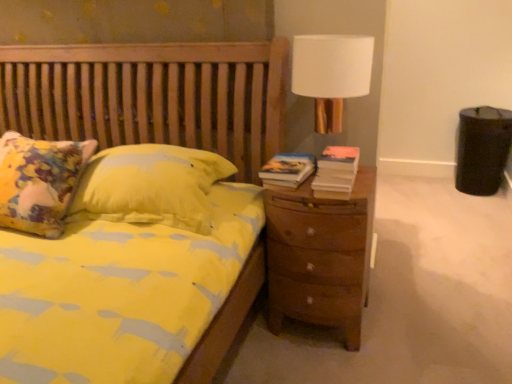
What do you see at coordinates (287, 169) in the screenshot?
I see `hardcover book at right, the 1th book positioned from the left` at bounding box center [287, 169].

Measure the distance between white fabric lampshade at upper right and camera.

white fabric lampshade at upper right and camera are 1.49 meters apart from each other.

What are the coordinates of `white fabric lampshade at upper right` in the screenshot? It's located at (331, 74).

Identify the location of hardcover book at right, the first book positioned from the right. (336, 169).

From a real-world perspective, is hardcover book at right, which is the 2th book in right-to-left order, physically located above or below brown wooden nightstand at right?

From a real-world perspective, hardcover book at right, which is the 2th book in right-to-left order, is physically above brown wooden nightstand at right.

Is the position of hardcover book at right, the 1th book positioned from the left, more distant than that of brown wooden nightstand at right?

Yes.

Is hardcover book at right, which is the 2th book in right-to-left order, at the left side of brown wooden nightstand at right?

Correct, you'll find hardcover book at right, which is the 2th book in right-to-left order, to the left of brown wooden nightstand at right.

Is brown wooden nightstand at right located within hardcover book at right, which is the 2th book in right-to-left order?

No.

Does hardcover book at right, the 1th book positioned from the left, have a greater height compared to hardcover book at right, the first book positioned from the right?

No.

Is hardcover book at right, which is the 2th book in right-to-left order, outside of hardcover book at right, the first book positioned from the right?

Yes.

Would you consider hardcover book at right, the 1th book positioned from the left, to be distant from hardcover book at right, the first book positioned from the right?

No.

At what (x,y) coordinates should I click in order to perform the action: click on book that is above the hardcover book at right, which is the 2th book in right-to-left order (from a real-world perspective). Please return your answer as a coordinate pair (x, y). This screenshot has height=384, width=512. Looking at the image, I should click on (336, 169).

Is brown wooden nightstand at right wider or thinner than hardcover book at right, which appears as the second book when viewed from the left?

brown wooden nightstand at right is wider than hardcover book at right, which appears as the second book when viewed from the left.

Based on the photo, considering the sizes of brown wooden nightstand at right and hardcover book at right, the first book positioned from the right, in the image, is brown wooden nightstand at right bigger or smaller than hardcover book at right, the first book positioned from the right,?

Considering their sizes, brown wooden nightstand at right takes up more space than hardcover book at right, the first book positioned from the right.

From the image's perspective, who appears lower, brown wooden nightstand at right or hardcover book at right, the first book positioned from the right?

brown wooden nightstand at right.

From a real-world perspective, is brown wooden nightstand at right physically below hardcover book at right, the first book positioned from the right?

Indeed, from a real-world perspective, brown wooden nightstand at right is positioned beneath hardcover book at right, the first book positioned from the right.

From the image's perspective, is brown wooden nightstand at right located above or below hardcover book at right, which is the 2th book in right-to-left order?

brown wooden nightstand at right is situated lower than hardcover book at right, which is the 2th book in right-to-left order, in the image.

Looking at this image, choose the correct answer: Is brown wooden nightstand at right inside hardcover book at right, which is the 2th book in right-to-left order, or outside it?

brown wooden nightstand at right is not enclosed by hardcover book at right, which is the 2th book in right-to-left order.

Which object is thinner, brown wooden nightstand at right or hardcover book at right, the 1th book positioned from the left?

hardcover book at right, the 1th book positioned from the left.

From a real-world perspective, between brown wooden nightstand at right and hardcover book at right, which is the 2th book in right-to-left order, who is vertically lower?

From a 3D spatial view, brown wooden nightstand at right is below.

Between point (348, 168) and point (308, 162), which one is positioned behind?

The point (308, 162) is farther from the camera.

I want to click on book on the right of hardcover book at right, which is the 2th book in right-to-left order, so 336,169.

Is hardcover book at right, the first book positioned from the right, looking in the opposite direction of hardcover book at right, which is the 2th book in right-to-left order?

hardcover book at right, the first book positioned from the right, does not have its back to hardcover book at right, which is the 2th book in right-to-left order.

From a real-world perspective, which object stands above the other?

hardcover book at right, which appears as the second book when viewed from the left.

Can you confirm if hardcover book at right, the 1th book positioned from the left, is bigger than white fabric lampshade at upper right?

Incorrect, hardcover book at right, the 1th book positioned from the left, is not larger than white fabric lampshade at upper right.

Is hardcover book at right, the 1th book positioned from the left, not within white fabric lampshade at upper right?

That's incorrect, hardcover book at right, the 1th book positioned from the left, is not completely outside white fabric lampshade at upper right.

Is hardcover book at right, which is the 2th book in right-to-left order, with white fabric lampshade at upper right?

Result: No, hardcover book at right, which is the 2th book in right-to-left order, is not making contact with white fabric lampshade at upper right.

Is the position of hardcover book at right, the first book positioned from the right, more distant than that of white fabric lampshade at upper right?

Yes, hardcover book at right, the first book positioned from the right, is behind white fabric lampshade at upper right.

Find the location of `lamp in front of the hardcover book at right, the first book positioned from the right`. lamp in front of the hardcover book at right, the first book positioned from the right is located at coordinates (331, 74).

Measure the distance from hardcover book at right, the first book positioned from the right, to white fabric lampshade at upper right.

hardcover book at right, the first book positioned from the right, and white fabric lampshade at upper right are 11.35 inches apart.

Is hardcover book at right, which appears as the second book when viewed from the left, situated inside white fabric lampshade at upper right or outside?

hardcover book at right, which appears as the second book when viewed from the left, is spatially positioned inside white fabric lampshade at upper right.

I want to click on nightstand below the hardcover book at right, which is the 2th book in right-to-left order (from a real-world perspective), so click(320, 256).

Where is `book above the hardcover book at right, the 1th book positioned from the left (from a real-world perspective)`? The image size is (512, 384). book above the hardcover book at right, the 1th book positioned from the left (from a real-world perspective) is located at coordinates (336, 169).

Considering their positions, is brown wooden nightstand at right positioned further to white fabric lampshade at upper right than hardcover book at right, which is the 2th book in right-to-left order?

The object further to white fabric lampshade at upper right is brown wooden nightstand at right.

Which object lies further to the anchor point white fabric lampshade at upper right, brown wooden nightstand at right or hardcover book at right, which appears as the second book when viewed from the left?

brown wooden nightstand at right.

Looking at the image, which one is located further to hardcover book at right, which appears as the second book when viewed from the left, brown wooden nightstand at right or hardcover book at right, which is the 2th book in right-to-left order?

brown wooden nightstand at right is further to hardcover book at right, which appears as the second book when viewed from the left.

When comparing their distances from brown wooden nightstand at right, does hardcover book at right, the 1th book positioned from the left, or white fabric lampshade at upper right seem further?

white fabric lampshade at upper right is positioned further to the anchor brown wooden nightstand at right.

When comparing their distances from hardcover book at right, the first book positioned from the right, does hardcover book at right, which is the 2th book in right-to-left order, or white fabric lampshade at upper right seem further?

Based on the image, white fabric lampshade at upper right appears to be further to hardcover book at right, the first book positioned from the right.

From the picture: Based on their spatial positions, is white fabric lampshade at upper right or hardcover book at right, the 1th book positioned from the left, further from hardcover book at right, the first book positioned from the right?

Among the two, white fabric lampshade at upper right is located further to hardcover book at right, the first book positioned from the right.

Based on their spatial positions, is hardcover book at right, which is the 2th book in right-to-left order, or brown wooden nightstand at right further from white fabric lampshade at upper right?

Based on the image, brown wooden nightstand at right appears to be further to white fabric lampshade at upper right.

Considering their positions, is hardcover book at right, which appears as the second book when viewed from the left, positioned closer to white fabric lampshade at upper right than brown wooden nightstand at right?

Based on the image, hardcover book at right, which appears as the second book when viewed from the left, appears to be nearer to white fabric lampshade at upper right.

Identify the location of book between hardcover book at right, which is the 2th book in right-to-left order, and brown wooden nightstand at right in the up-down direction. The height and width of the screenshot is (384, 512). (336, 169).

Where is `book between white fabric lampshade at upper right and hardcover book at right, which appears as the second book when viewed from the left, in the up-down direction`? The height and width of the screenshot is (384, 512). book between white fabric lampshade at upper right and hardcover book at right, which appears as the second book when viewed from the left, in the up-down direction is located at coordinates (287, 169).